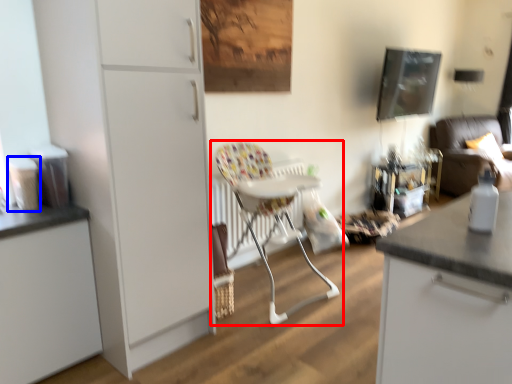
Question: Among these objects, which one is farthest to the camera, chair (highlighted by a red box) or appliance (highlighted by a blue box)?

Choices:
 (A) chair
 (B) appliance

Answer: (A)